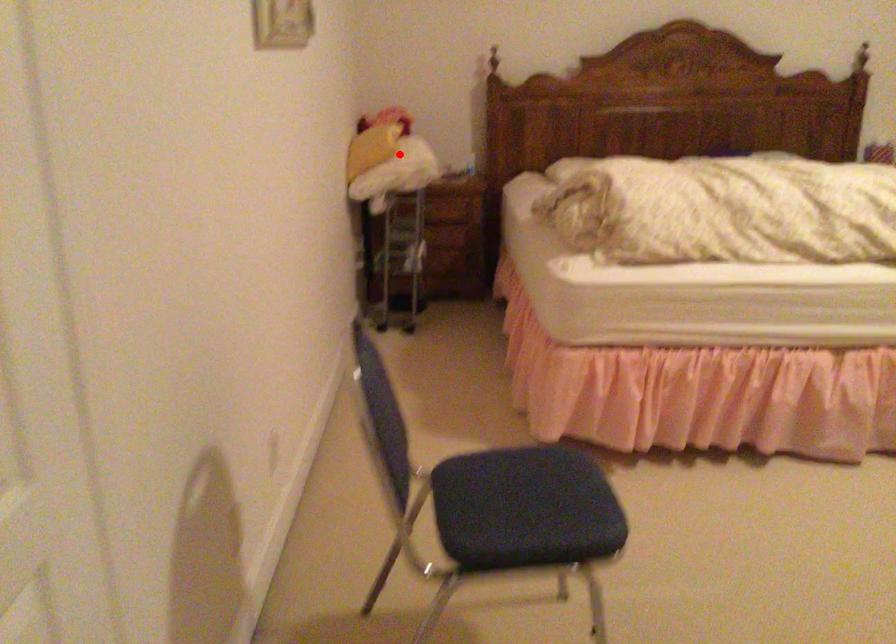
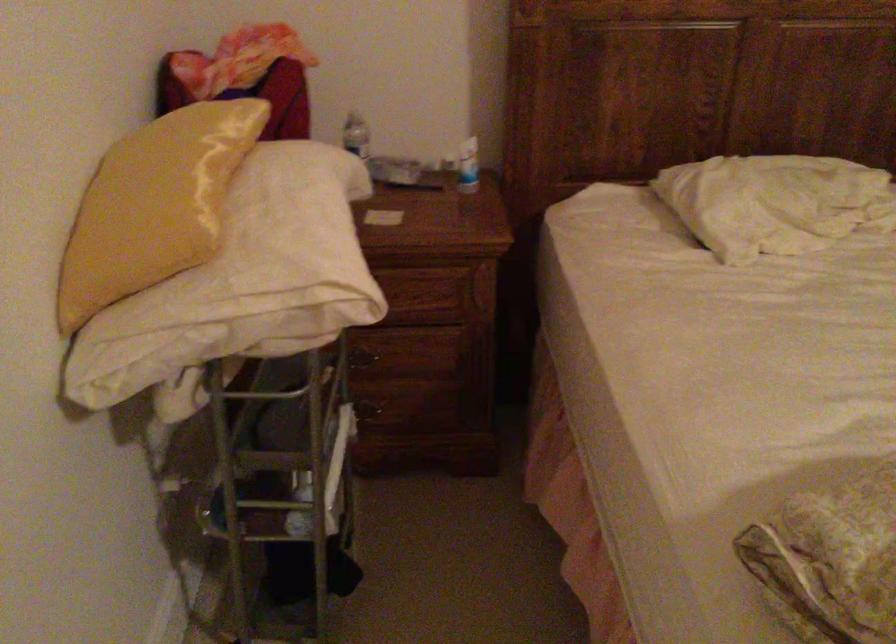
In the second image, find the point that corresponds to the highlighted location in the first image.

(254, 272)